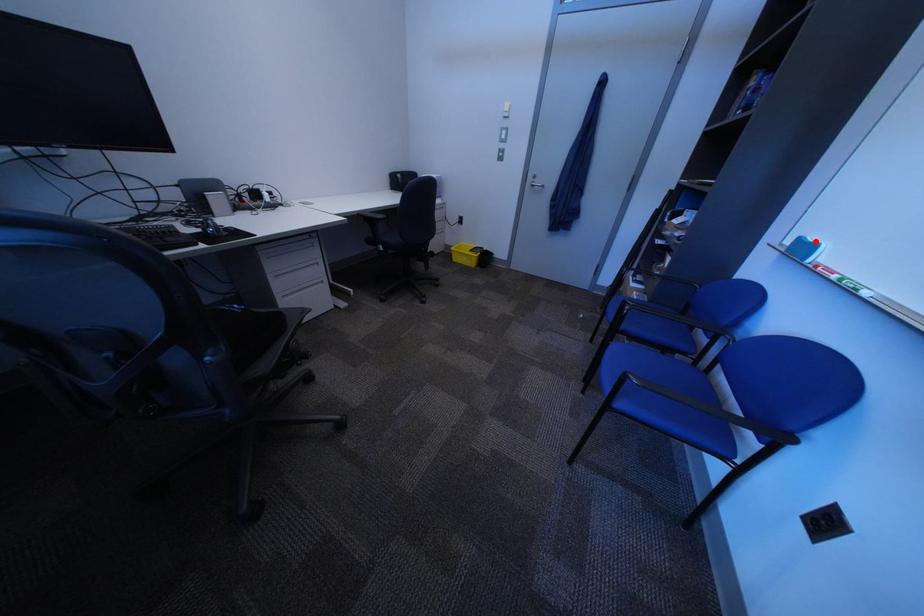
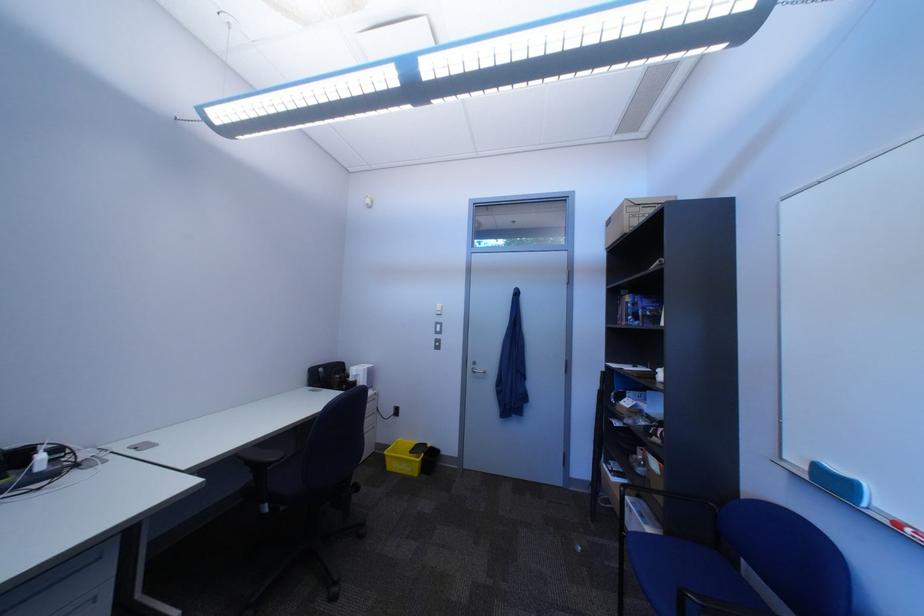
Find the pixel in the second image that matches the highlighted location in the first image.

(833, 468)